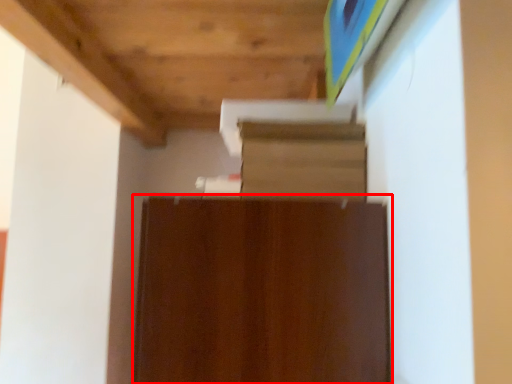
Question: From the image's perspective, where is cabinetry (annotated by the red box) located relative to shelf?

Choices:
 (A) above
 (B) below

Answer: (B)